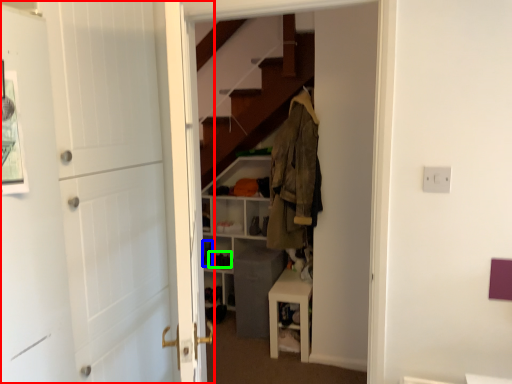
Question: Based on their relative distances, which object is farther from door (highlighted by a red box)? Choose from shoe (highlighted by a blue box) and shoe (highlighted by a green box).

Choices:
 (A) shoe
 (B) shoe

Answer: (B)